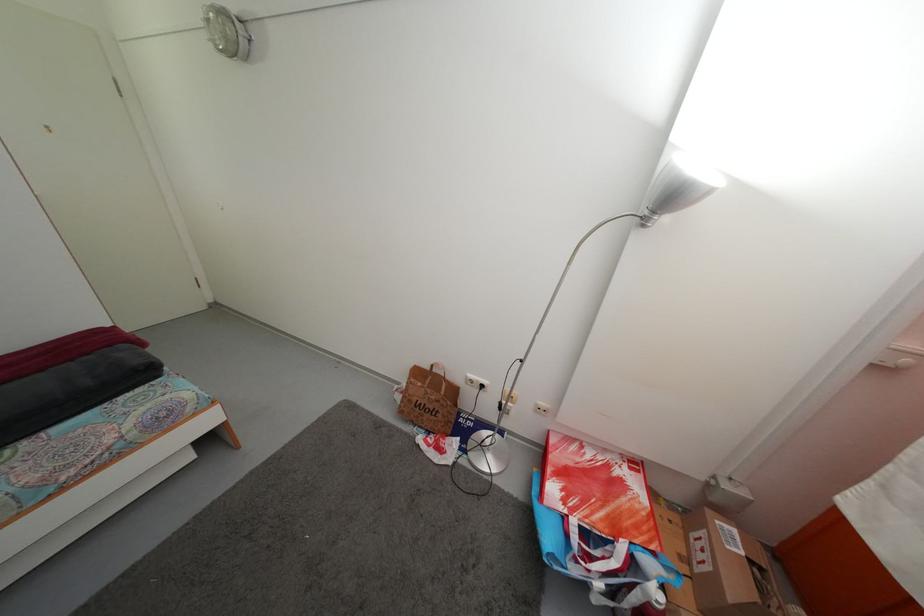
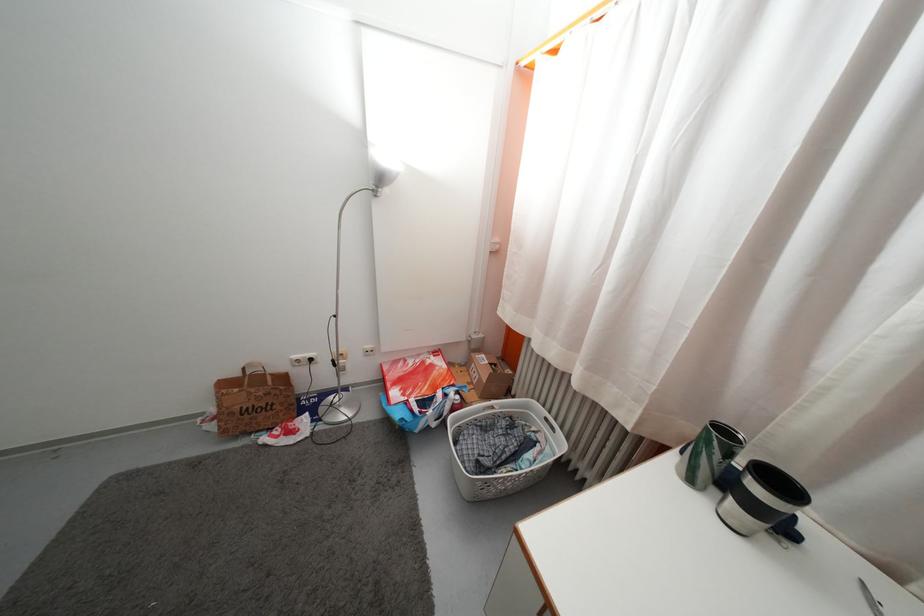
Locate, in the second image, the point that corresponds to (x=651, y=220) in the first image.

(379, 195)